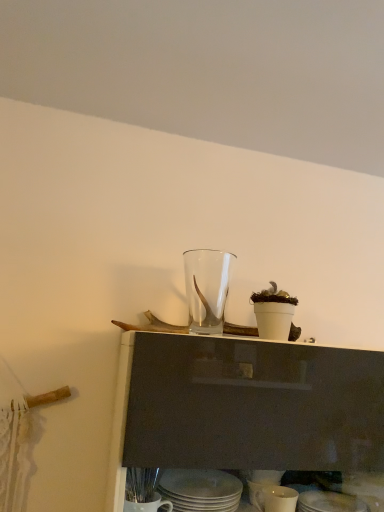
Question: From the image's perspective, relative to white ceramic plates at lower center, which appears as the second tableware when viewed from the top, is matte white plate at lower center, which ranks as the fourth tableware in top-to-bottom order, above or below?

Choices:
 (A) below
 (B) above

Answer: (A)

Question: Considering the positions of matte white plate at lower center, which appears as the first tableware when ordered from the bottom, and white ceramic plates at lower center, which appears as the second tableware when viewed from the top, in the image, is matte white plate at lower center, which appears as the first tableware when ordered from the bottom, taller or shorter than white ceramic plates at lower center, which appears as the second tableware when viewed from the top,?

Choices:
 (A) short
 (B) tall

Answer: (B)

Question: Which object is positioned closest to the white glossy mug at lower center, acting as the 2th tableware starting from the bottom?

Choices:
 (A) white ceramic plates at lower center, which appears as the second tableware when viewed from the top
 (B) matte white plate at lower center, which ranks as the fourth tableware in top-to-bottom order
 (C) transparent glass vase at center, arranged as the 1th tableware when viewed from the top

Answer: (B)

Question: Considering the real-world distances, which object is closest to the white ceramic plates at lower center, which appears as the second tableware when viewed from the top?

Choices:
 (A) transparent glass vase at center, which is the fourth tableware in bottom-to-top order
 (B) white glossy mug at lower center, arranged as the 3th tableware when viewed from the top
 (C) matte white plate at lower center, which appears as the first tableware when ordered from the bottom

Answer: (B)